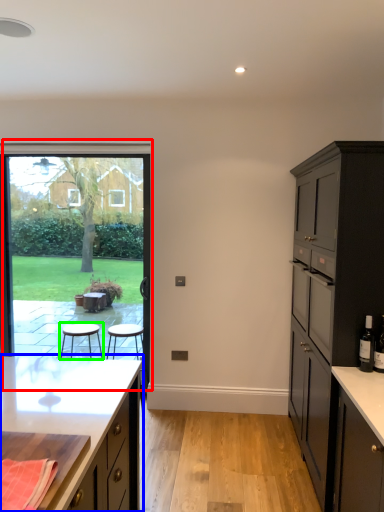
Question: Which is nearer to the window (highlighted by a red box)? cabinetry (highlighted by a blue box) or stool (highlighted by a green box).

Choices:
 (A) cabinetry
 (B) stool

Answer: (B)